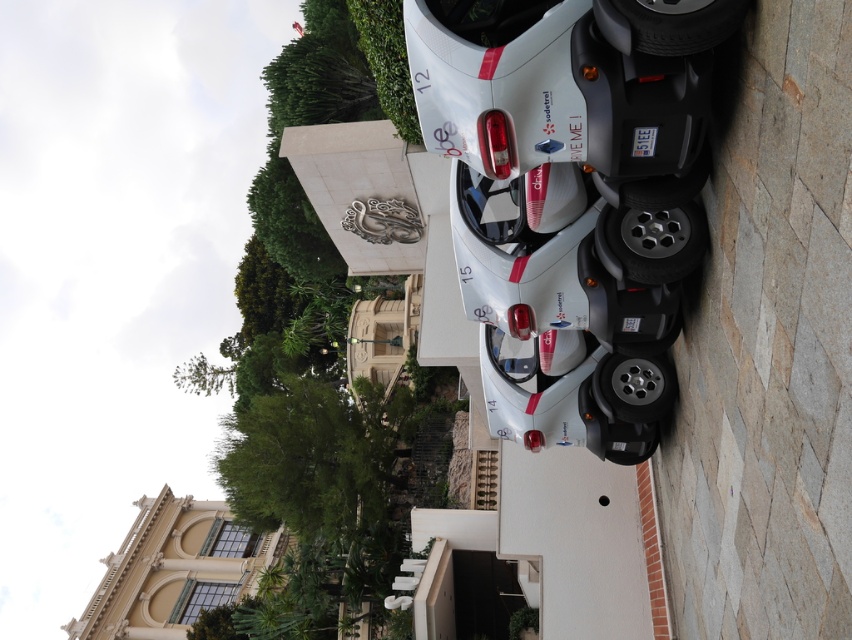
Between black rubber tire at upper right and metallic silver tire at center, which one has more height?

With more height is metallic silver tire at center.

Between black rubber tire at upper right and metallic silver tire at center, which one has less height?

black rubber tire at upper right is shorter.

Does point (665, 33) lie in front of point (699, 256)?

That is True.

You are a GUI agent. You are given a task and a screenshot of the screen. Output one action in this format:
    pyautogui.click(x=<x>, y=<y>)
    Task: Click on the black rubber tire at upper right
    
    Given the screenshot: What is the action you would take?
    pyautogui.click(x=666, y=22)

The width and height of the screenshot is (852, 640). What do you see at coordinates (657, 241) in the screenshot? I see `metallic silver tire at center` at bounding box center [657, 241].

Is point (607, 228) in front of point (632, 385)?

Yes, point (607, 228) is in front of point (632, 385).

You are a GUI agent. You are given a task and a screenshot of the screen. Output one action in this format:
    pyautogui.click(x=<x>, y=<y>)
    Task: Click on the metallic silver tire at center
    This screenshot has height=640, width=852.
    Given the screenshot: What is the action you would take?
    pyautogui.click(x=657, y=241)

Which of these two, black rubber tire at upper right or black rubber tire at lower right, stands shorter?

black rubber tire at upper right is shorter.

From the picture: Can you confirm if black rubber tire at upper right is wider than black rubber tire at lower right?

Indeed, black rubber tire at upper right has a greater width compared to black rubber tire at lower right.

Who is more distant from viewer, (603, 6) or (640, 412)?

Positioned behind is point (640, 412).

Find the location of a particular element. This screenshot has width=852, height=640. black rubber tire at upper right is located at coordinates (666, 22).